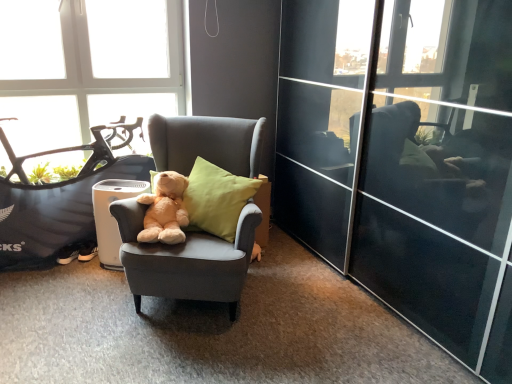
Question: Is matte gray armchair at center at the left side of soft plush teddy bear at center?

Choices:
 (A) yes
 (B) no

Answer: (B)

Question: Considering the relative sizes of matte gray armchair at center and soft plush teddy bear at center in the image provided, is matte gray armchair at center smaller than soft plush teddy bear at center?

Choices:
 (A) yes
 (B) no

Answer: (B)

Question: Does matte gray armchair at center have a greater width compared to soft plush teddy bear at center?

Choices:
 (A) no
 (B) yes

Answer: (B)

Question: Could you tell me if matte gray armchair at center is turned towards soft plush teddy bear at center?

Choices:
 (A) yes
 (B) no

Answer: (A)

Question: Is matte gray armchair at center completely or partially outside of soft plush teddy bear at center?

Choices:
 (A) no
 (B) yes

Answer: (B)

Question: Is transparent glass window at upper left spatially inside transparent glass screen door at center, or outside of it?

Choices:
 (A) outside
 (B) inside

Answer: (A)

Question: Considering the relative positions of transparent glass window at upper left and transparent glass screen door at center in the image provided, is transparent glass window at upper left to the left or to the right of transparent glass screen door at center?

Choices:
 (A) right
 (B) left

Answer: (B)

Question: In terms of size, does transparent glass window at upper left appear bigger or smaller than transparent glass screen door at center?

Choices:
 (A) big
 (B) small

Answer: (B)

Question: Considering the positions of point (158, 34) and point (291, 89), is point (158, 34) closer or farther from the camera than point (291, 89)?

Choices:
 (A) farther
 (B) closer

Answer: (A)

Question: Is soft plush teddy bear at center spatially inside soft yellow cushion at center, or outside of it?

Choices:
 (A) inside
 (B) outside

Answer: (B)

Question: Is soft plush teddy bear at center wider or thinner than soft yellow cushion at center?

Choices:
 (A) thin
 (B) wide

Answer: (B)

Question: From the image's perspective, is soft plush teddy bear at center positioned above or below soft yellow cushion at center?

Choices:
 (A) above
 (B) below

Answer: (B)

Question: Relative to soft yellow cushion at center, is soft plush teddy bear at center in front or behind?

Choices:
 (A) front
 (B) behind

Answer: (A)

Question: Based on their positions, is transparent glass window at upper left located to the left or right of matte gray armchair at center?

Choices:
 (A) left
 (B) right

Answer: (A)

Question: Is transparent glass window at upper left bigger or smaller than matte gray armchair at center?

Choices:
 (A) big
 (B) small

Answer: (B)